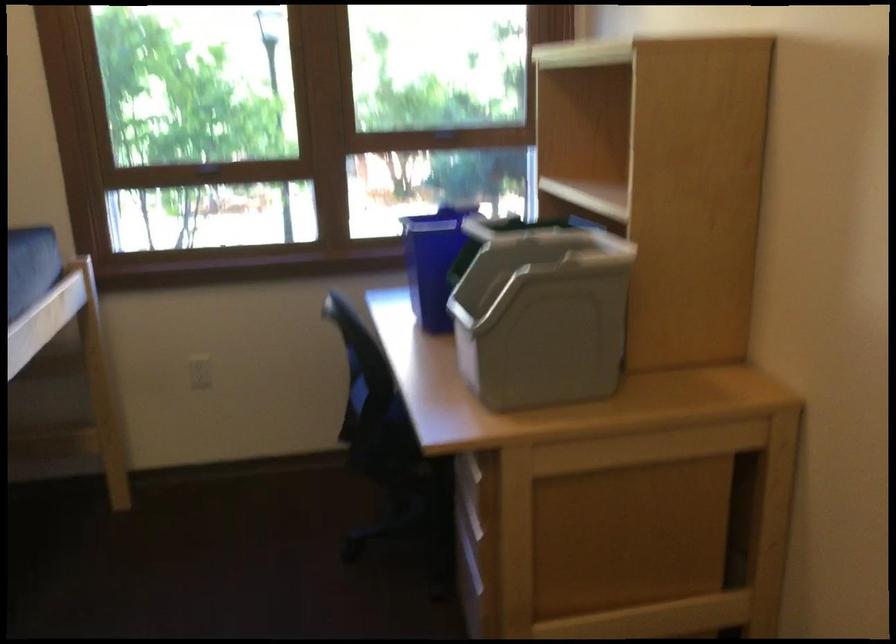
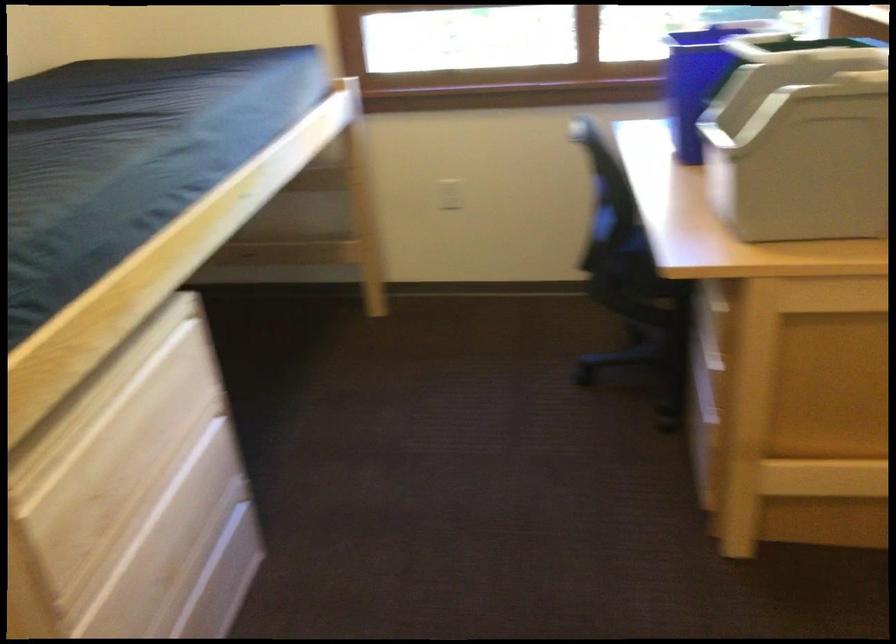
Question: The first image is from the beginning of the video and the second image is from the end. How did the camera likely rotate when shooting the video?

Choices:
 (A) Left
 (B) Right
 (C) Up
 (D) Down

Answer: (A)